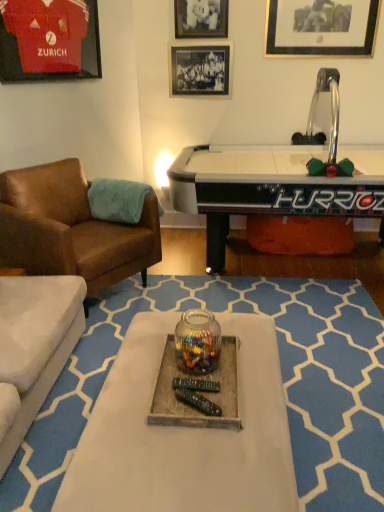
Where is `free area in between translucent glass jar at center and black plastic remote control at center, arranged as the second remote control when viewed from the back`? Image resolution: width=384 pixels, height=512 pixels. free area in between translucent glass jar at center and black plastic remote control at center, arranged as the second remote control when viewed from the back is located at coordinates (194, 390).